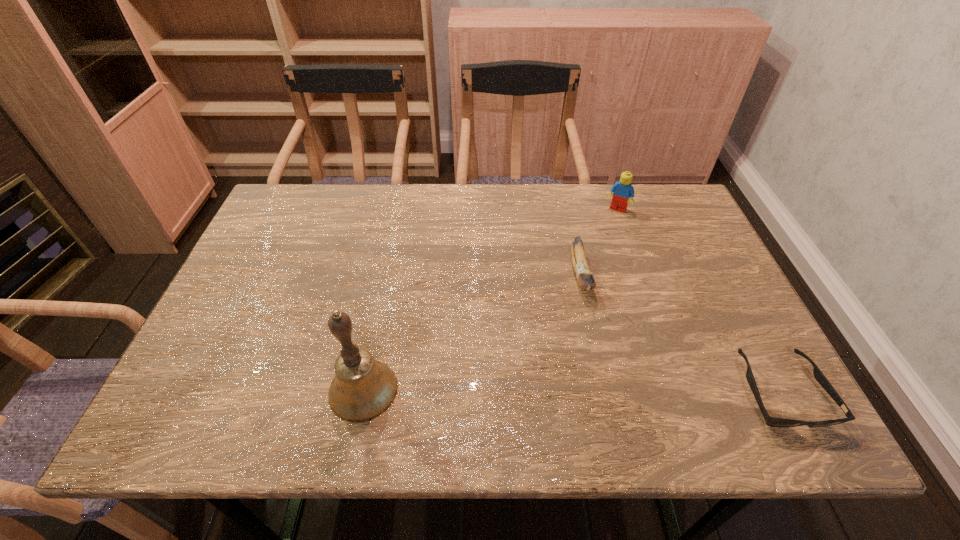
I want to click on free space on the desktop that is between the bell and the shortest object and is positioned on the peel of the banana, so click(x=611, y=392).

Locate an element on the screen. The width and height of the screenshot is (960, 540). vacant space on the desktop that is between the leftmost object and the shortest object and is positioned on the face of the second tallest object is located at coordinates (514, 391).